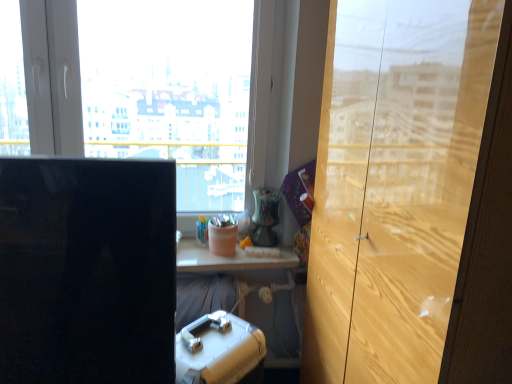
Question: Does pink matte container at center, positioned as the 2th stationery in back-to-front order, have a larger size compared to black glossy computer monitor at left?

Choices:
 (A) yes
 (B) no

Answer: (B)

Question: Is black glossy computer monitor at left a part of pink matte container at center, positioned as the 2th stationery in front-to-back order?

Choices:
 (A) no
 (B) yes

Answer: (A)

Question: Can you see pink matte container at center, positioned as the 2th stationery in front-to-back order, touching black glossy computer monitor at left?

Choices:
 (A) yes
 (B) no

Answer: (B)

Question: Does pink matte container at center, positioned as the 2th stationery in back-to-front order, turn towards black glossy computer monitor at left?

Choices:
 (A) yes
 (B) no

Answer: (B)

Question: Is pink matte container at center, positioned as the 2th stationery in back-to-front order, taller than black glossy computer monitor at left?

Choices:
 (A) no
 (B) yes

Answer: (A)

Question: Is point (64, 127) positioned closer to the camera than point (411, 292)?

Choices:
 (A) closer
 (B) farther

Answer: (B)

Question: From a real-world perspective, is transparent glass window at center physically located above or below wooden cabinet at right?

Choices:
 (A) above
 (B) below

Answer: (A)

Question: In terms of size, does transparent glass window at center appear bigger or smaller than wooden cabinet at right?

Choices:
 (A) small
 (B) big

Answer: (A)

Question: Is transparent glass window at center wider or thinner than wooden cabinet at right?

Choices:
 (A) thin
 (B) wide

Answer: (A)

Question: Is point (206, 243) positioned closer to the camera than point (154, 195)?

Choices:
 (A) farther
 (B) closer

Answer: (A)

Question: Considering the positions of matte plastic cup at center, which is counted as the first stationery, starting from the back, and black glossy computer monitor at left in the image, is matte plastic cup at center, which is counted as the first stationery, starting from the back, taller or shorter than black glossy computer monitor at left?

Choices:
 (A) tall
 (B) short

Answer: (B)

Question: From a real-world perspective, is matte plastic cup at center, arranged as the 1th stationery when viewed from the top, physically located above or below black glossy computer monitor at left?

Choices:
 (A) below
 (B) above

Answer: (A)

Question: From the image's perspective, relative to black glossy computer monitor at left, is matte plastic cup at center, which is counted as the first stationery, starting from the back, above or below?

Choices:
 (A) below
 (B) above

Answer: (B)

Question: Is wooden cabinet at right wider or thinner than pink matte container at center, positioned as the 2th stationery in front-to-back order?

Choices:
 (A) thin
 (B) wide

Answer: (B)

Question: Based on their positions, is wooden cabinet at right located to the left or right of pink matte container at center, which is counted as the 2th stationery, starting from the bottom?

Choices:
 (A) left
 (B) right

Answer: (B)